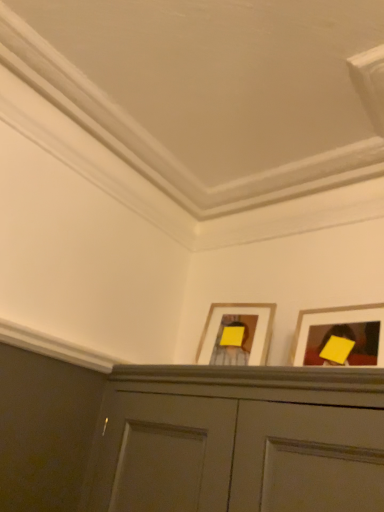
Locate an element on the screen. The width and height of the screenshot is (384, 512). yellow matte picture frame at upper right, arranged as the 1th picture frame when viewed from the right is located at coordinates pyautogui.click(x=341, y=336).

This screenshot has height=512, width=384. Describe the element at coordinates (341, 336) in the screenshot. I see `yellow matte picture frame at upper right, which is the second picture frame in back-to-front order` at that location.

The width and height of the screenshot is (384, 512). What do you see at coordinates (252, 336) in the screenshot?
I see `yellow matte picture frame at upper center, the 1th picture frame viewed from the back` at bounding box center [252, 336].

Find the location of `yellow matte picture frame at upper center, the second picture frame in the right-to-left sequence`. yellow matte picture frame at upper center, the second picture frame in the right-to-left sequence is located at coordinates (252, 336).

In order to click on yellow matte picture frame at upper right, placed as the 2th picture frame when sorted from left to right in this screenshot , I will do `click(341, 336)`.

From the picture: Considering the positions of objects yellow matte picture frame at upper right, placed as the 2th picture frame when sorted from left to right, and yellow matte picture frame at upper center, the first picture frame in the left-to-right sequence, in the image provided, who is more to the left, yellow matte picture frame at upper right, placed as the 2th picture frame when sorted from left to right, or yellow matte picture frame at upper center, the first picture frame in the left-to-right sequence,?

Positioned to the left is yellow matte picture frame at upper center, the first picture frame in the left-to-right sequence.

Does yellow matte picture frame at upper right, the 1th picture frame viewed from the front, come in front of yellow matte picture frame at upper center, the second picture frame in the right-to-left sequence?

Yes, yellow matte picture frame at upper right, the 1th picture frame viewed from the front, is closer to the camera.

Which is more distant, (353, 326) or (267, 316)?

The point (267, 316) is farther.

From the image's perspective, is yellow matte picture frame at upper right, the 1th picture frame viewed from the front, above or below yellow matte picture frame at upper center, the first picture frame in the left-to-right sequence?

Based on their image positions, yellow matte picture frame at upper right, the 1th picture frame viewed from the front, is located above yellow matte picture frame at upper center, the first picture frame in the left-to-right sequence.

From a real-world perspective, which is physically below, yellow matte picture frame at upper right, placed as the 2th picture frame when sorted from left to right, or yellow matte picture frame at upper center, which is the 2th picture frame from front to back?

From a 3D spatial view, yellow matte picture frame at upper right, placed as the 2th picture frame when sorted from left to right, is below.

Does yellow matte picture frame at upper right, which is the second picture frame in back-to-front order, have a lesser width compared to yellow matte picture frame at upper center, the second picture frame in the right-to-left sequence?

Yes.

Who is taller, yellow matte picture frame at upper right, placed as the 2th picture frame when sorted from left to right, or yellow matte picture frame at upper center, which is the 2th picture frame from front to back?

Standing taller between the two is yellow matte picture frame at upper right, placed as the 2th picture frame when sorted from left to right.

Who is smaller, yellow matte picture frame at upper right, arranged as the 1th picture frame when viewed from the right, or yellow matte picture frame at upper center, the 1th picture frame viewed from the back?

yellow matte picture frame at upper right, arranged as the 1th picture frame when viewed from the right, is smaller.

Is yellow matte picture frame at upper right, placed as the 2th picture frame when sorted from left to right, located outside yellow matte picture frame at upper center, the first picture frame in the left-to-right sequence?

Yes.

Is yellow matte picture frame at upper right, which is the second picture frame in back-to-front order, far from yellow matte picture frame at upper center, the first picture frame in the left-to-right sequence?

No.

Is yellow matte picture frame at upper right, arranged as the 1th picture frame when viewed from the right, aimed at yellow matte picture frame at upper center, which is the 2th picture frame from front to back?

No, yellow matte picture frame at upper right, arranged as the 1th picture frame when viewed from the right, is not turned towards yellow matte picture frame at upper center, which is the 2th picture frame from front to back.

What's the angular difference between yellow matte picture frame at upper right, arranged as the 1th picture frame when viewed from the right, and yellow matte picture frame at upper center, the 1th picture frame viewed from the back,'s facing directions?

There is a 15.5-degree angle between the facing directions of yellow matte picture frame at upper right, arranged as the 1th picture frame when viewed from the right, and yellow matte picture frame at upper center, the 1th picture frame viewed from the back.

I want to click on picture frame lying above the yellow matte picture frame at upper center, the first picture frame in the left-to-right sequence (from the image's perspective), so click(x=341, y=336).

Based on the photo, does yellow matte picture frame at upper center, the first picture frame in the left-to-right sequence, appear on the left side of yellow matte picture frame at upper right, placed as the 2th picture frame when sorted from left to right?

Indeed, yellow matte picture frame at upper center, the first picture frame in the left-to-right sequence, is positioned on the left side of yellow matte picture frame at upper right, placed as the 2th picture frame when sorted from left to right.

Which object is more forward, yellow matte picture frame at upper center, the 1th picture frame viewed from the back, or yellow matte picture frame at upper right, the 1th picture frame viewed from the front?

yellow matte picture frame at upper right, the 1th picture frame viewed from the front, is more forward.

Is point (200, 340) closer to viewer compared to point (335, 356)?

No.

From the image's perspective, is yellow matte picture frame at upper center, the second picture frame in the right-to-left sequence, on yellow matte picture frame at upper right, the 1th picture frame viewed from the front?

No.

From a real-world perspective, between yellow matte picture frame at upper center, the second picture frame in the right-to-left sequence, and yellow matte picture frame at upper right, arranged as the 1th picture frame when viewed from the right, who is vertically lower?

In real-world perspective, yellow matte picture frame at upper right, arranged as the 1th picture frame when viewed from the right, is lower.

Considering the relative sizes of yellow matte picture frame at upper center, the first picture frame in the left-to-right sequence, and yellow matte picture frame at upper right, which is the second picture frame in back-to-front order, in the image provided, is yellow matte picture frame at upper center, the first picture frame in the left-to-right sequence, thinner than yellow matte picture frame at upper right, which is the second picture frame in back-to-front order,?

No, yellow matte picture frame at upper center, the first picture frame in the left-to-right sequence, is not thinner than yellow matte picture frame at upper right, which is the second picture frame in back-to-front order.

From their relative heights in the image, would you say yellow matte picture frame at upper center, which is the 2th picture frame from front to back, is taller or shorter than yellow matte picture frame at upper right, the 1th picture frame viewed from the front?

Considering their sizes, yellow matte picture frame at upper center, which is the 2th picture frame from front to back, has less height than yellow matte picture frame at upper right, the 1th picture frame viewed from the front.

Does yellow matte picture frame at upper center, the first picture frame in the left-to-right sequence, have a smaller size compared to yellow matte picture frame at upper right, arranged as the 1th picture frame when viewed from the right?

Incorrect, yellow matte picture frame at upper center, the first picture frame in the left-to-right sequence, is not smaller in size than yellow matte picture frame at upper right, arranged as the 1th picture frame when viewed from the right.

Is yellow matte picture frame at upper center, the 1th picture frame viewed from the back, inside or outside of yellow matte picture frame at upper right, which is the second picture frame in back-to-front order?

yellow matte picture frame at upper center, the 1th picture frame viewed from the back, is not inside yellow matte picture frame at upper right, which is the second picture frame in back-to-front order, it's outside.

Is yellow matte picture frame at upper center, the 1th picture frame viewed from the back, beside yellow matte picture frame at upper right, the 1th picture frame viewed from the front?

No, yellow matte picture frame at upper center, the 1th picture frame viewed from the back, is not in contact with yellow matte picture frame at upper right, the 1th picture frame viewed from the front.

Is yellow matte picture frame at upper center, the 1th picture frame viewed from the back, positioned with its back to yellow matte picture frame at upper right, which is the second picture frame in back-to-front order?

yellow matte picture frame at upper center, the 1th picture frame viewed from the back, does not have its back to yellow matte picture frame at upper right, which is the second picture frame in back-to-front order.

Can you tell me how much yellow matte picture frame at upper center, the first picture frame in the left-to-right sequence, and yellow matte picture frame at upper right, the 1th picture frame viewed from the front, differ in facing direction?

The angular difference between yellow matte picture frame at upper center, the first picture frame in the left-to-right sequence, and yellow matte picture frame at upper right, the 1th picture frame viewed from the front, is 15.5 degrees.

Image resolution: width=384 pixels, height=512 pixels. What are the coordinates of `picture frame to the left of yellow matte picture frame at upper right, the 1th picture frame viewed from the front` in the screenshot? It's located at (252, 336).

This screenshot has height=512, width=384. What are the coordinates of `picture frame on the left of yellow matte picture frame at upper right, placed as the 2th picture frame when sorted from left to right` in the screenshot? It's located at (252, 336).

In the image, there is a yellow matte picture frame at upper center, the second picture frame in the right-to-left sequence. At what (x,y) coordinates should I click in order to perform the action: click on picture frame below it (from a real-world perspective). Please return your answer as a coordinate pair (x, y). Looking at the image, I should click on (341, 336).